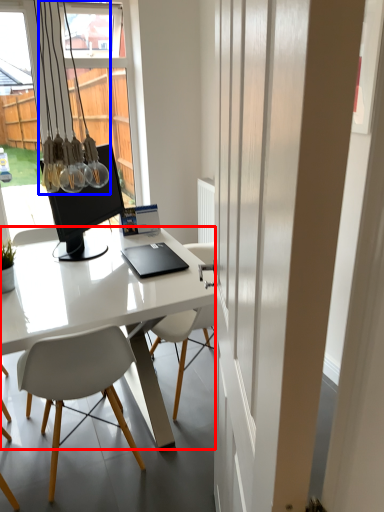
Question: Which object appears farthest to the camera in this image, desk (highlighted by a red box) or light fixture (highlighted by a blue box)?

Choices:
 (A) desk
 (B) light fixture

Answer: (B)